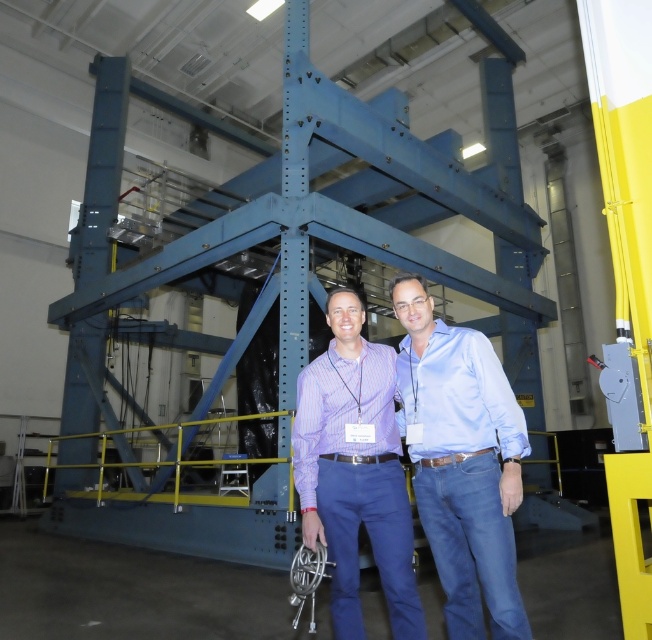
How much distance is there between blue jeans at center and purple checkered shirt at center?

blue jeans at center is 11.27 inches away from purple checkered shirt at center.

Is blue jeans at center below purple checkered shirt at center?

No.

In order to click on blue jeans at center in this screenshot , I will do `click(462, 461)`.